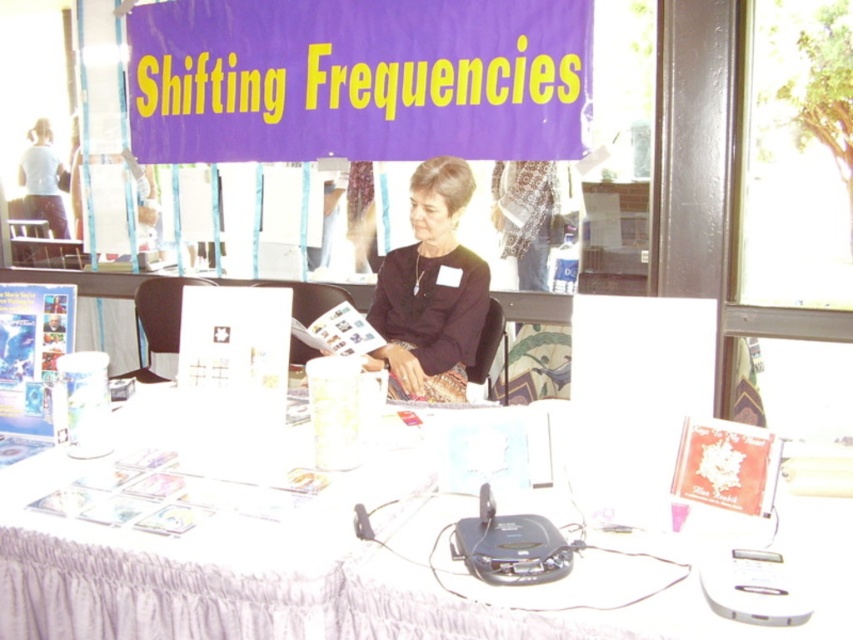
You are organizing a small event and need to decide whether to place a large decorative centerpiece on the table. Given the white fabric tablecloth at lower center and the black matte dress at center, which object has a greater width and can accommodate the centerpiece better?

The white fabric tablecloth at lower center has a greater width than the black matte dress at center, so it can accommodate the centerpiece better.